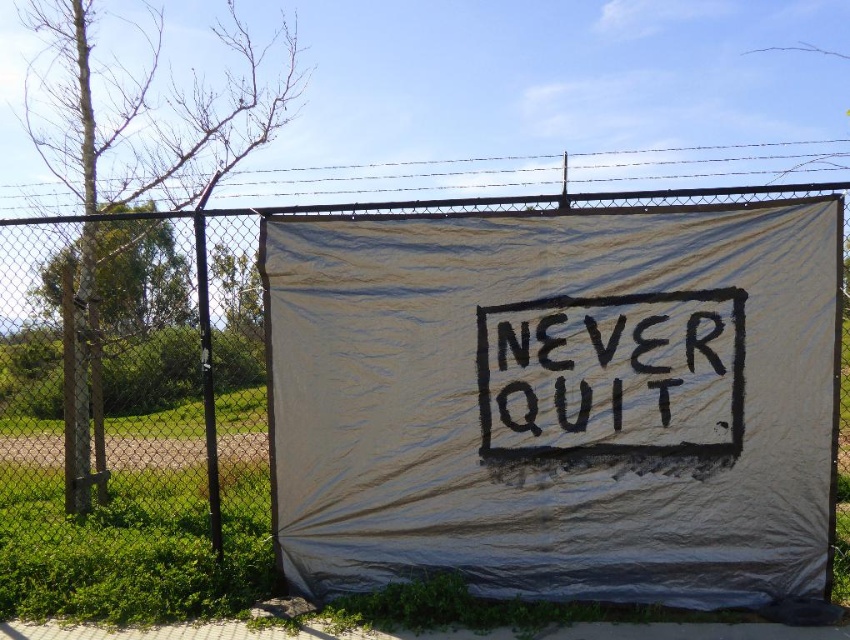
You are standing in front of a fence with a banner. Where is the white fabric banner at center located in terms of its 2D coordinates?

The white fabric banner at center is located at the 2D coordinates of point (265, 328).

You are an artist planning to paint a mural on the white fabric banner at center and the black chalkboard at center. Which surface will require more horizontal space due to its greater width?

The black chalkboard at center has a greater width than the white fabric banner at center, so it will require more horizontal space.